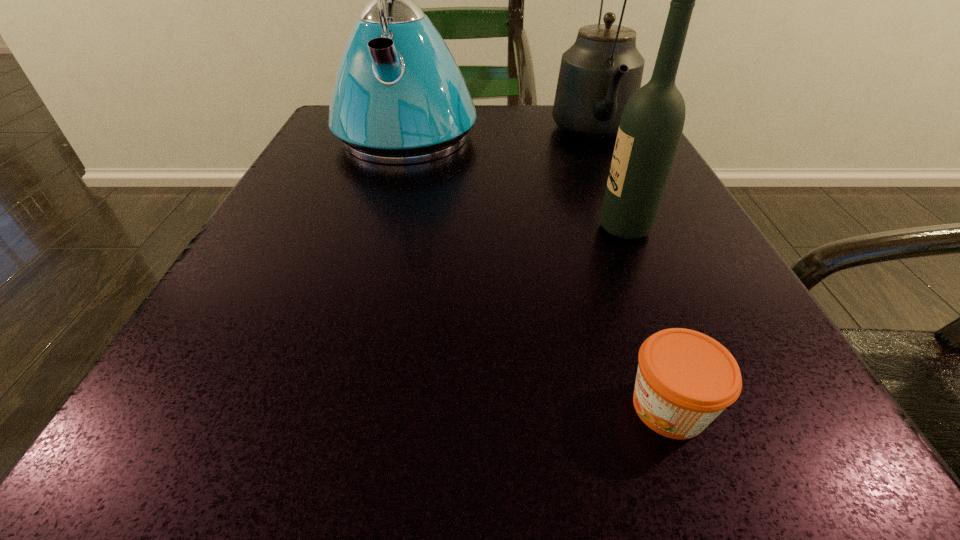
Identify the location of the left kettle. This screenshot has width=960, height=540. (399, 97).

The image size is (960, 540). I want to click on the right kettle, so click(599, 73).

The width and height of the screenshot is (960, 540). Identify the location of the third farthest object. (651, 126).

Where is `the second shortest object`? the second shortest object is located at coordinates (651, 126).

Locate an element on the screen. This screenshot has width=960, height=540. jam is located at coordinates (685, 379).

Locate an element on the screen. This screenshot has width=960, height=540. the shortest object is located at coordinates pyautogui.click(x=685, y=379).

In order to click on free spot located 0.100m at the spout of the leftmost object in this screenshot , I will do `click(387, 203)`.

Locate an element on the screen. vacant space located spout on the right kettle is located at coordinates (681, 329).

In order to click on free location located 0.370m on the labeled side of the wine bottle in this screenshot , I will do `click(348, 228)`.

I want to click on vacant space situated 0.050m on the labeled side of the wine bottle, so click(564, 228).